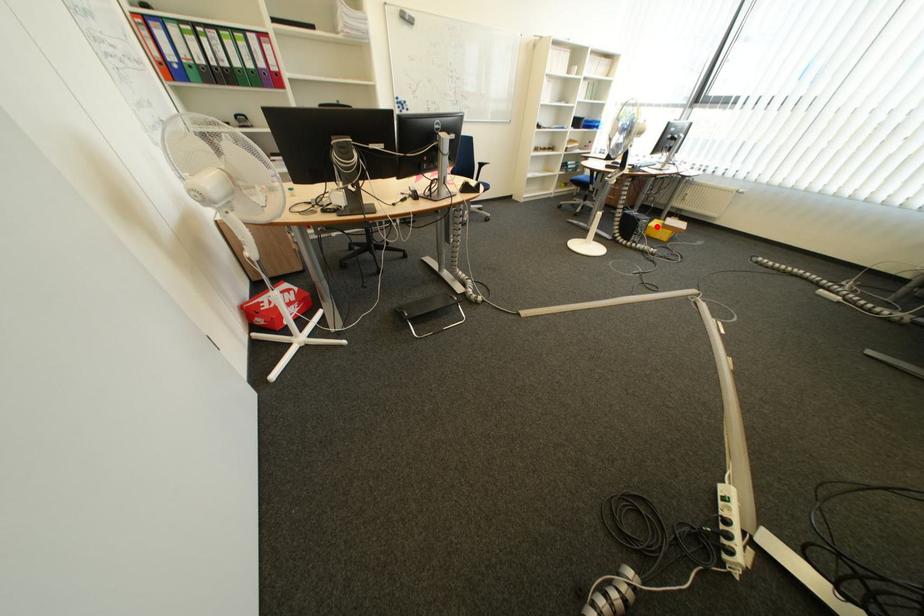
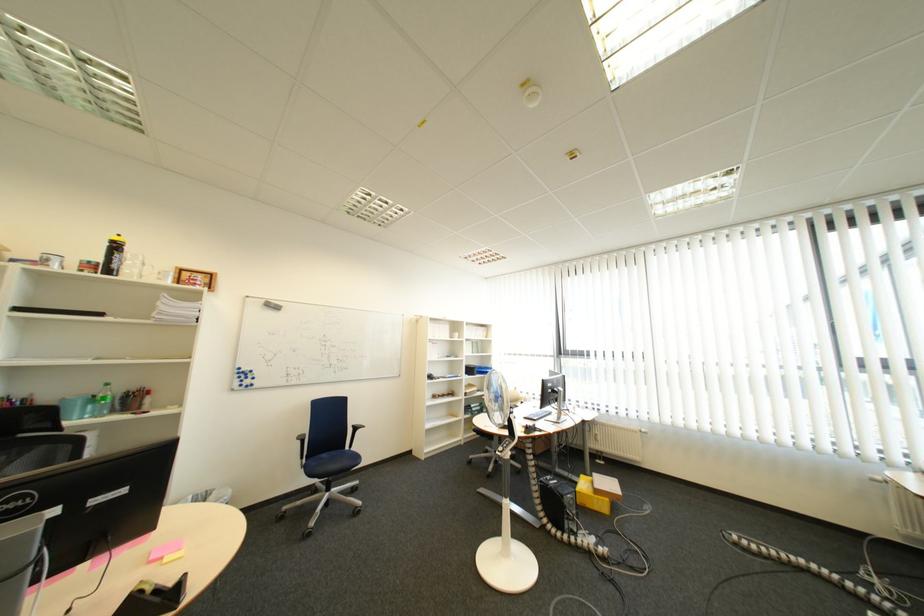
Question: I am providing you with two images of the same scene from different viewpoints. A red point is shown in image1. For the corresponding object point in image2, is it positioned nearer or farther from the camera?

Choices:
 (A) Nearer
 (B) Farther

Answer: (B)